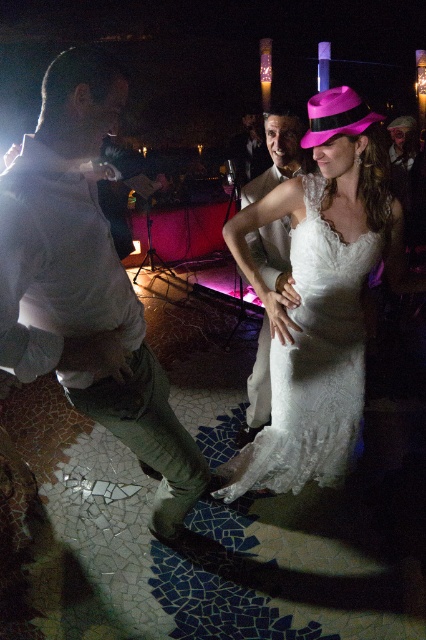
Is white lace dress at center further to the viewer compared to matte white suit at center?

No, it is in front of matte white suit at center.

Does white lace dress at center have a lesser height compared to matte white suit at center?

No, white lace dress at center is not shorter than matte white suit at center.

Which is in front, point (293, 240) or point (250, 376)?

Point (293, 240) is more forward.

At what (x,y) coordinates should I click in order to perform the action: click on white lace dress at center. Please return your answer as a coordinate pair (x, y). This screenshot has width=426, height=640. Looking at the image, I should click on (313, 364).

Looking at this image, does white cotton shirt at left appear on the left side of white lace dress at center?

Correct, you'll find white cotton shirt at left to the left of white lace dress at center.

Does white cotton shirt at left have a greater width compared to white lace dress at center?

Incorrect, white cotton shirt at left's width does not surpass white lace dress at center's.

What do you see at coordinates (86, 284) in the screenshot? I see `white cotton shirt at left` at bounding box center [86, 284].

Where is `white cotton shirt at left`? The image size is (426, 640). white cotton shirt at left is located at coordinates (86, 284).

Does white cotton shirt at left appear under matte white suit at center?

Indeed, white cotton shirt at left is positioned under matte white suit at center.

Based on the photo, which is above, white cotton shirt at left or matte white suit at center?

matte white suit at center is above.

Find the location of a particular element. white cotton shirt at left is located at coordinates (86, 284).